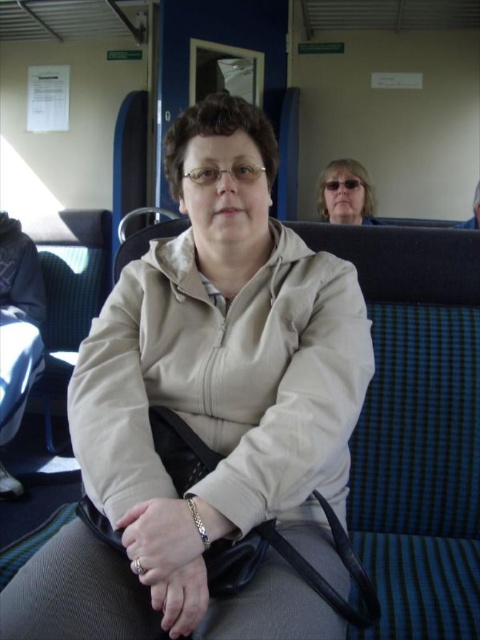
Between beige fabric jacket at center and matte black sunglasses at upper center, which one has less height?

matte black sunglasses at upper center is shorter.

Does beige fabric jacket at center appear under matte black sunglasses at upper center?

Yes.

Locate an element on the screen. The height and width of the screenshot is (640, 480). beige fabric jacket at center is located at coordinates (210, 413).

The height and width of the screenshot is (640, 480). In order to click on beige fabric jacket at center in this screenshot , I will do `click(210, 413)`.

Looking at this image, who is more distant from viewer, (x=242, y=120) or (x=193, y=508)?

The point (x=242, y=120) is more distant.

Is beige fabric jacket at center further to the viewer compared to silver metallic bracelet at lower center?

That is False.

Does point (149, 593) come in front of point (200, 520)?

No.

The width and height of the screenshot is (480, 640). Identify the location of beige fabric jacket at center. (210, 413).

Does point (358, 196) come farther from viewer compared to point (186, 497)?

Yes, it is.

Is matte black sunglasses at upper center smaller than silver metallic bracelet at lower center?

No.

At what (x,y) coordinates should I click in order to perform the action: click on matte black sunglasses at upper center. Please return your answer as a coordinate pair (x, y). This screenshot has width=480, height=640. Looking at the image, I should click on click(x=346, y=193).

Locate an element on the screen. The image size is (480, 640). matte black sunglasses at upper center is located at coordinates (346, 193).